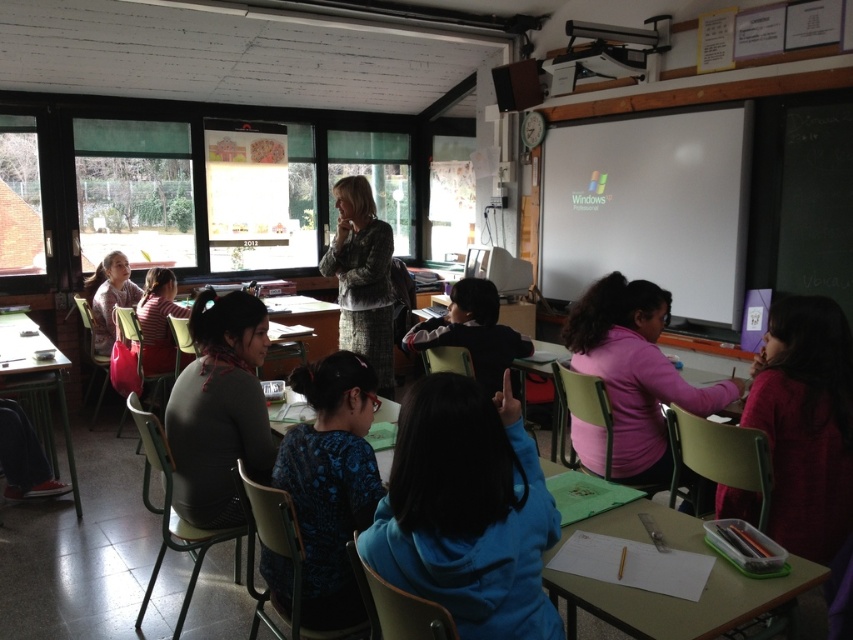
Consider the image. Does pink matte shirt at center lie in front of patterned fabric jacket at center?

That is True.

Who is more forward, [619,300] or [360,320]?

Point [619,300] is in front.

Is point (634, 324) positioned behind point (383, 301)?

That is False.

The height and width of the screenshot is (640, 853). In order to click on pink matte shirt at center in this screenshot , I will do `click(636, 372)`.

Which is more to the left, blue fleece jacket at center or green plastic table at center?

blue fleece jacket at center

Is blue fleece jacket at center to the left of green plastic table at center from the viewer's perspective?

Yes, blue fleece jacket at center is to the left of green plastic table at center.

This screenshot has height=640, width=853. Find the location of `blue fleece jacket at center`. blue fleece jacket at center is located at coordinates (467, 512).

This screenshot has height=640, width=853. Find the location of `blue fleece jacket at center`. blue fleece jacket at center is located at coordinates pyautogui.click(x=467, y=512).

Which of these two, blue fleece jacket at center or patterned fabric jacket at center, stands shorter?

blue fleece jacket at center

The width and height of the screenshot is (853, 640). I want to click on blue fleece jacket at center, so tap(467, 512).

Locate an element on the screen. blue fleece jacket at center is located at coordinates (467, 512).